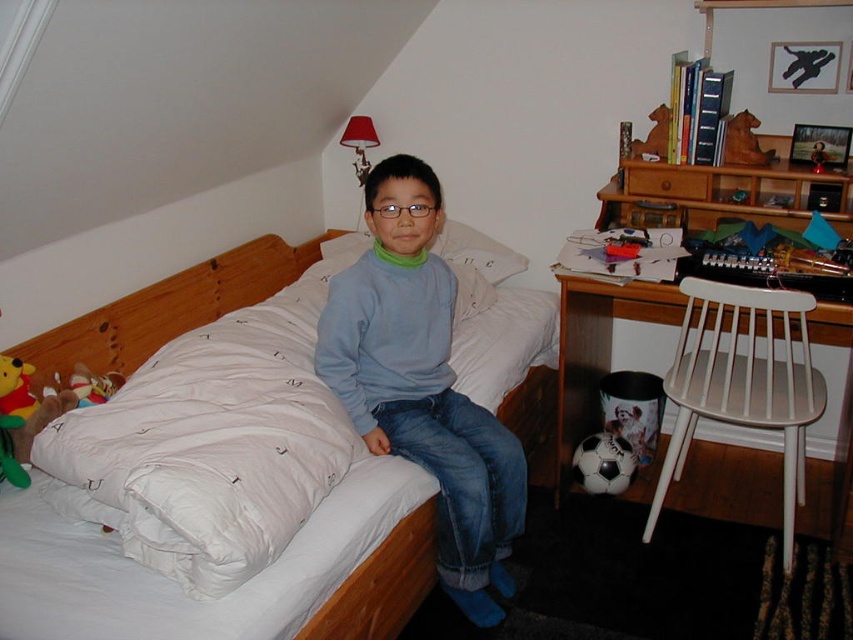
Can you confirm if light blue sweater at center is positioned to the left of white soft bed at center?

In fact, light blue sweater at center is to the right of white soft bed at center.

Who is more distant from viewer, (451, 284) or (428, 580)?

Point (451, 284)

What do you see at coordinates (422, 385) in the screenshot?
I see `light blue sweater at center` at bounding box center [422, 385].

Where is `light blue sweater at center`? The image size is (853, 640). light blue sweater at center is located at coordinates (422, 385).

Who is more distant from viewer, (523, 456) or (737, 346)?

Point (737, 346)

Between point (393, 275) and point (727, 285), which one is positioned in front?

Point (393, 275)

At what (x,y) coordinates should I click in order to perform the action: click on light blue sweater at center. Please return your answer as a coordinate pair (x, y). The height and width of the screenshot is (640, 853). Looking at the image, I should click on (422, 385).

Find the location of a particular element. The width and height of the screenshot is (853, 640). light blue sweater at center is located at coordinates (422, 385).

Is point (367, 609) in front of point (672, 369)?

That is True.

Locate an element on the screen. The height and width of the screenshot is (640, 853). white soft bed at center is located at coordinates (171, 307).